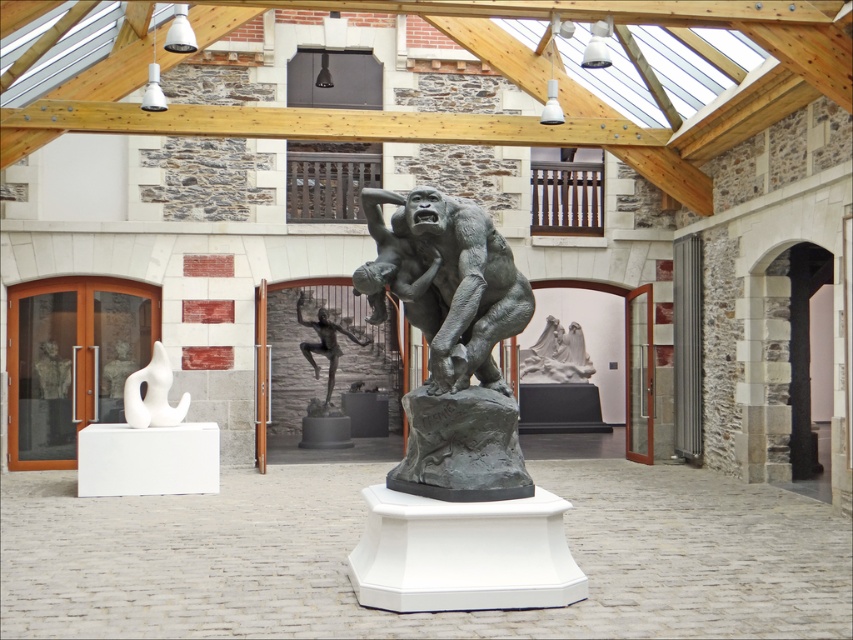
Question: Which point is closer to the camera?

Choices:
 (A) (129, 394)
 (B) (405, 481)
 (C) (300, 312)

Answer: (B)

Question: Is bronze statue at center below bronze nude figure at center?

Choices:
 (A) no
 (B) yes

Answer: (A)

Question: Does white glossy abstract sculpture at left lie behind bronze nude figure at center?

Choices:
 (A) no
 (B) yes

Answer: (A)

Question: Which object is closer to the camera taking this photo?

Choices:
 (A) bronze nude figure at center
 (B) white glossy abstract sculpture at left

Answer: (B)

Question: Considering the relative positions of bronze statue at center and bronze nude figure at center in the image provided, where is bronze statue at center located with respect to bronze nude figure at center?

Choices:
 (A) left
 (B) right

Answer: (B)

Question: Among these points, which one is farthest from the camera?

Choices:
 (A) (129, 420)
 (B) (444, 282)
 (C) (322, 348)

Answer: (C)